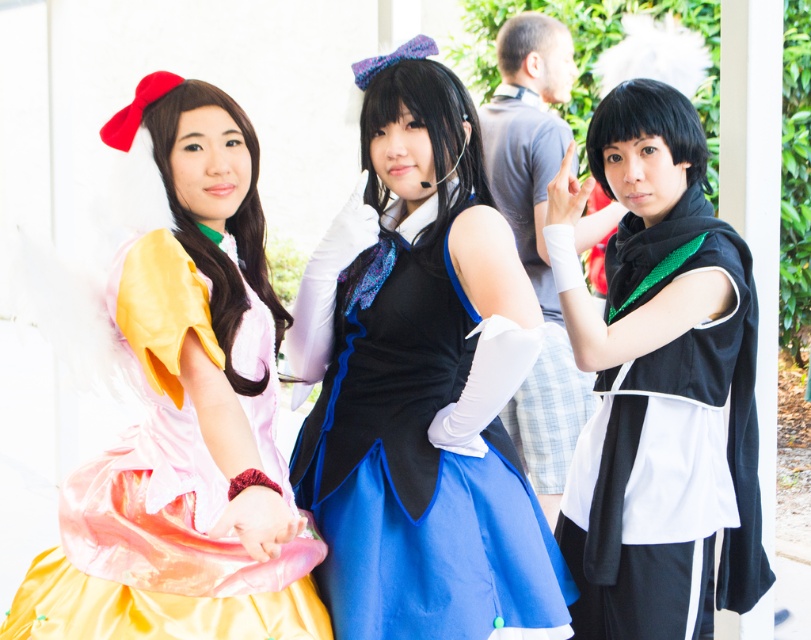
You are standing at the point labeled point (x=693, y=125) and want to walk to the point labeled point (x=114, y=371). Which direction should you face to move towards your destination?

You should face forward because point (x=114, y=371) is in front of point (x=693, y=125).

From the picture: You are a photographer trying to capture a photo of the blue satin dress at center and the black matte uniform at right. Which object is closer to the camera based on their positions?

The blue satin dress at center is positioned under the black matte uniform at right, so the black matte uniform at right is closer to the camera.

You are a photographer standing 5 feet away from the blue satin dress at center and the black matte uniform at right. You want to capture both subjects in a single frame without moving your camera. Can you fit both into the photo? Explain your reasoning.

The blue satin dress at center and the black matte uniform at right are 19.77 inches apart from each other. Since the photographer is 5 feet away, which is approximately 60 inches, the distance between the subjects is much smaller than the photographer distance. Therefore, both subjects can be captured in a single frame without moving the camera.